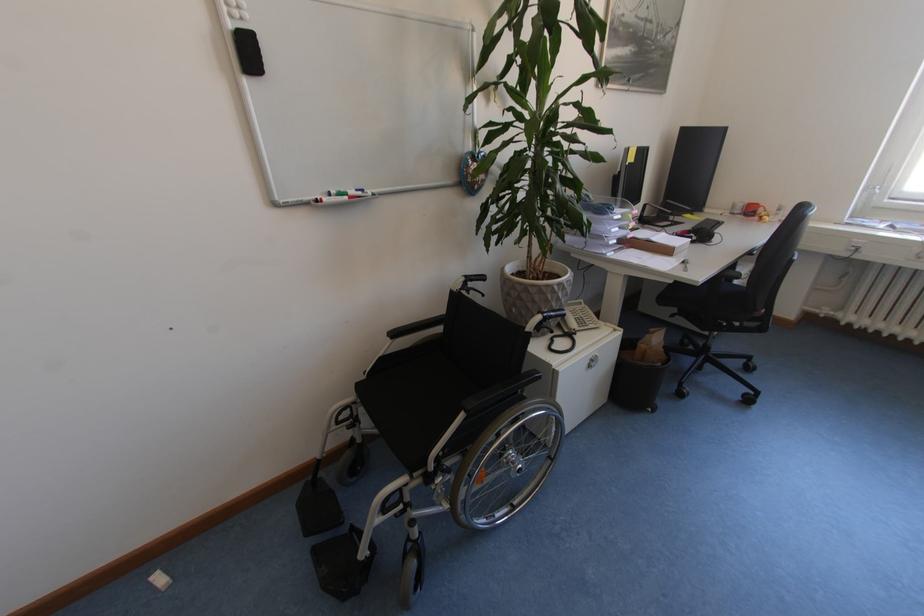
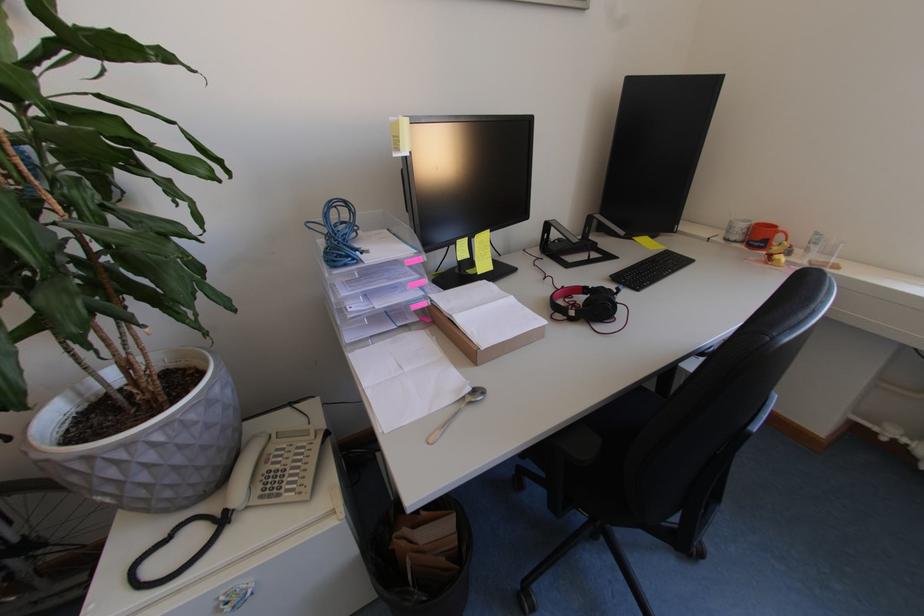
In the second image, find the point that corresponds to point 784,216 in the first image.

(816, 253)